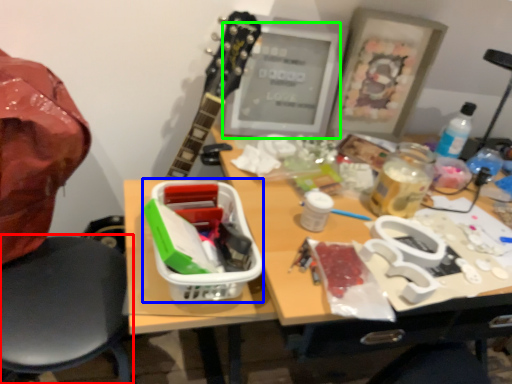
Question: Which object is the closest to the chair (highlighted by a red box)? Choose among these: lunch box (highlighted by a blue box) or computer monitor (highlighted by a green box).

Choices:
 (A) lunch box
 (B) computer monitor

Answer: (A)